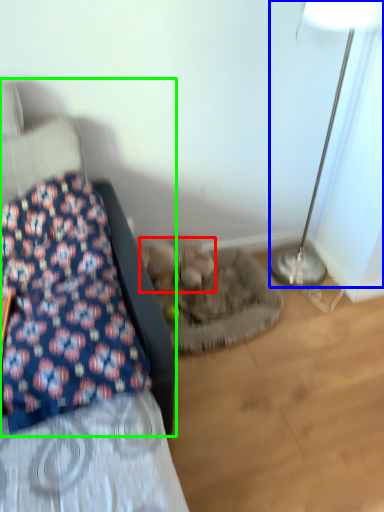
Question: Estimate the real-world distances between objects in this image. Which object is farther from animal (highlighted by a red box), lamp (highlighted by a blue box) or furniture (highlighted by a green box)?

Choices:
 (A) lamp
 (B) furniture

Answer: (A)